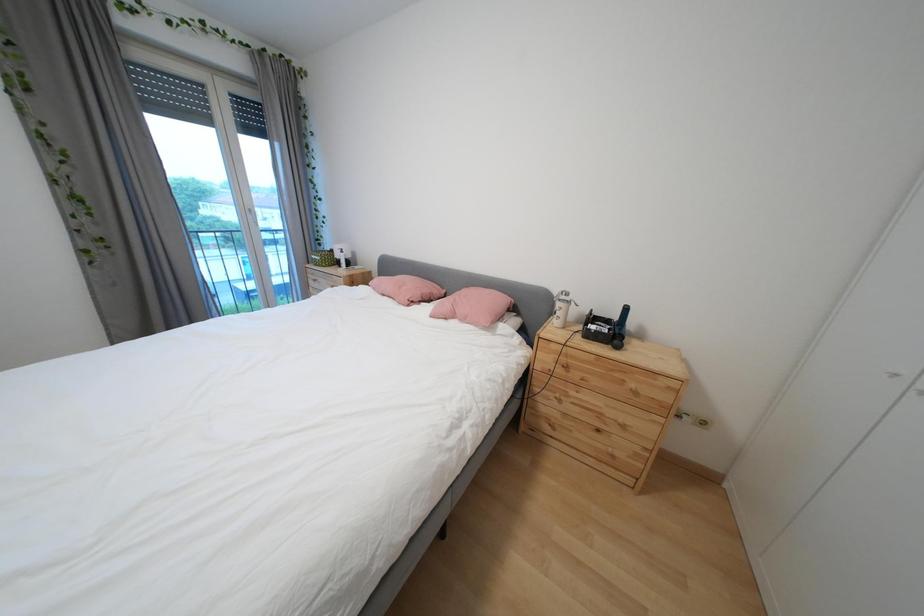
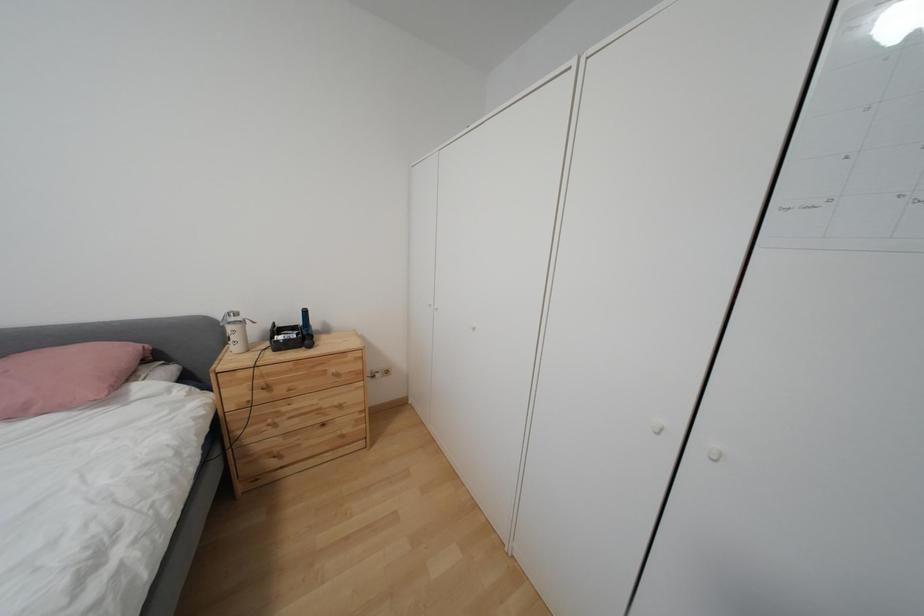
Question: Based on the continuous images, in which direction is the camera rotating? Reply with the corresponding letter.

Choices:
 (A) Left
 (B) Right
 (C) Up
 (D) Down

Answer: (B)